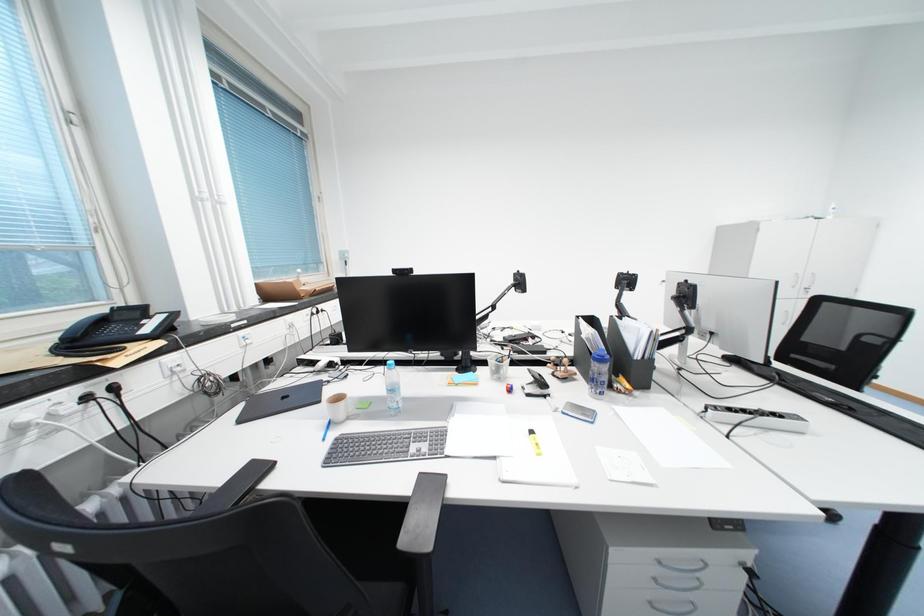
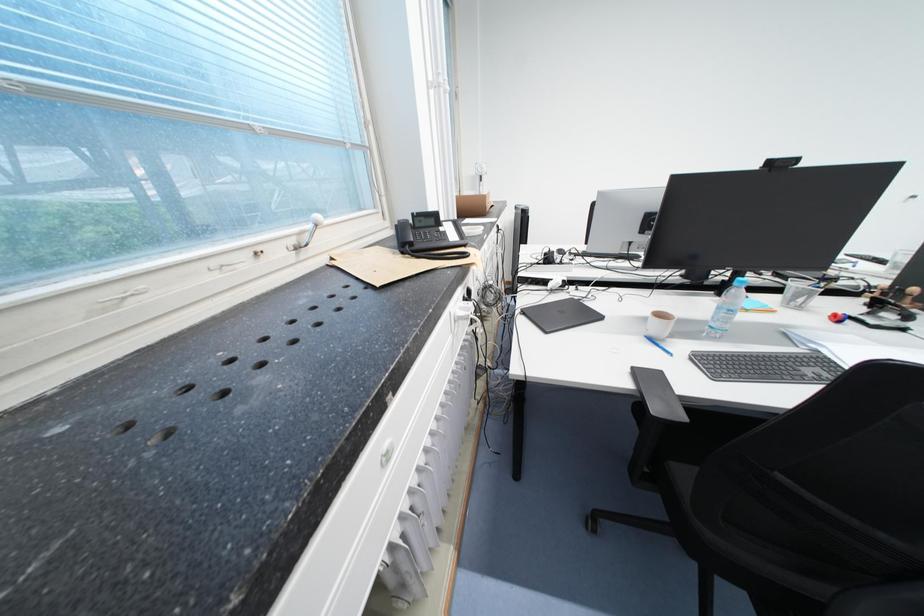
Question: Which direction would the cameraman need to move to produce the second image? Reply with the corresponding letter.

Choices:
 (A) Left
 (B) Right
 (C) Forward
 (D) Backward

Answer: (A)